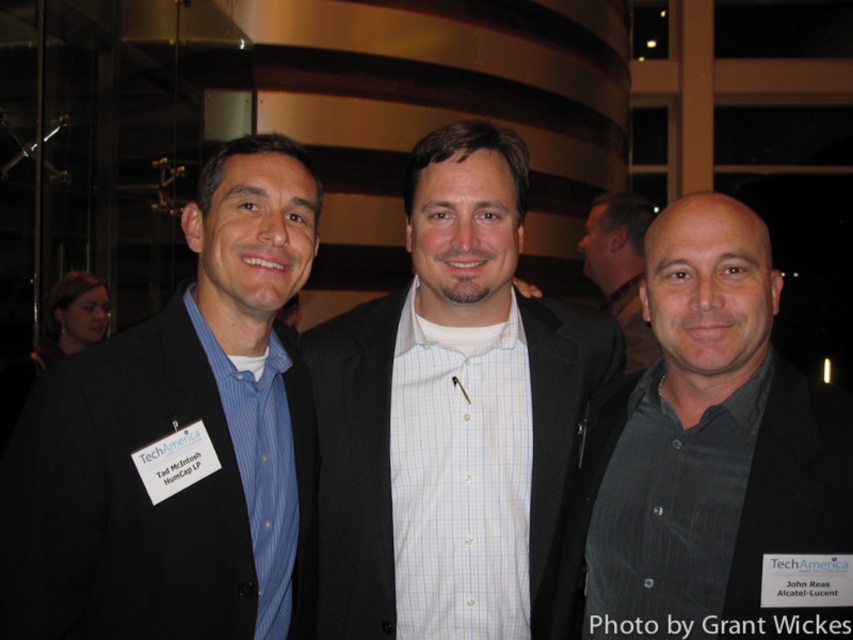
Based on the scene description, which object is positioned to the left of the other between the matte black suit at left and the gray textured shirt at center?

The matte black suit at left is positioned to the left of the gray textured shirt at center.